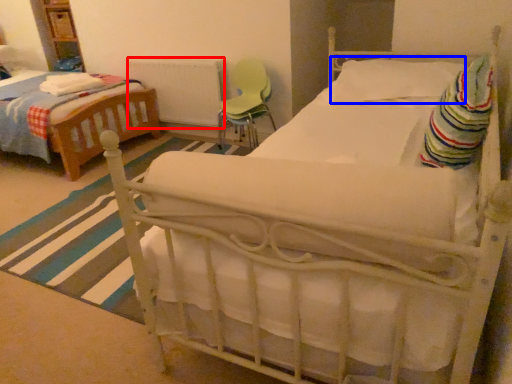
Question: Among these objects, which one is nearest to the camera, radiator (highlighted by a red box) or pillow (highlighted by a blue box)?

Choices:
 (A) radiator
 (B) pillow

Answer: (B)